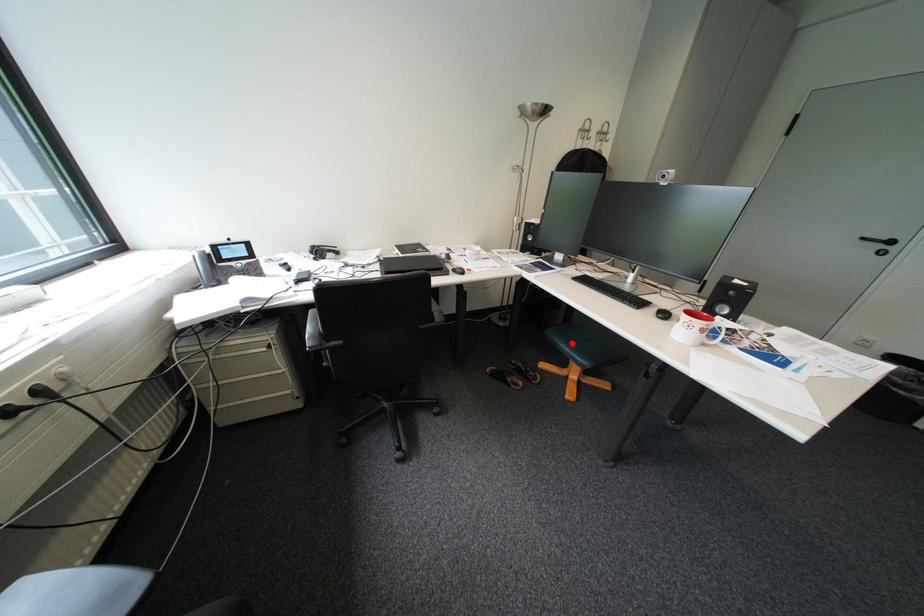
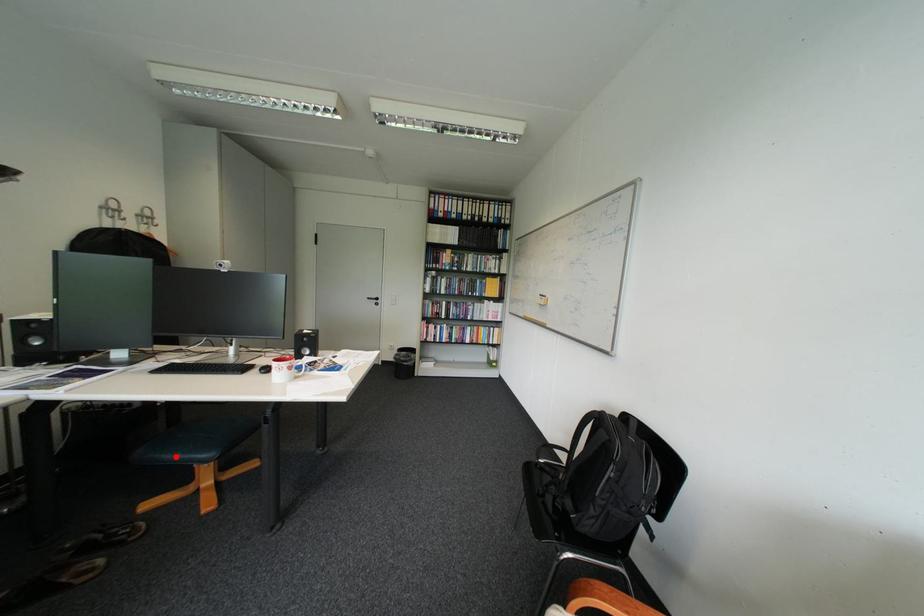
I am providing you with two images of the same scene from different viewpoints. A red point is marked on the first image and another point is marked on the second image. Does the point marked in image1 correspond to the same location as the one in image2?

Yes